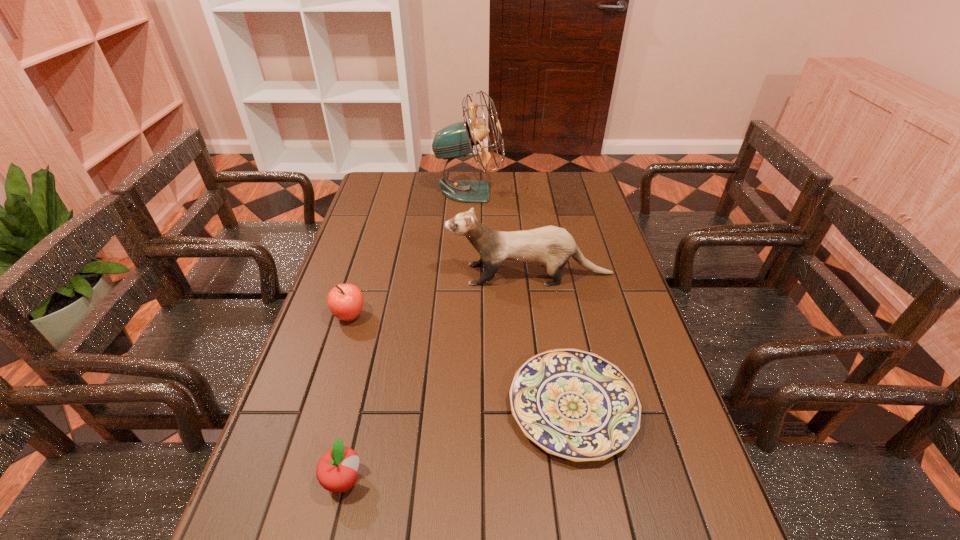
I want to click on fan, so click(456, 140).

Where is `the tallest object`? Image resolution: width=960 pixels, height=540 pixels. the tallest object is located at coordinates (456, 140).

Where is `the second farthest object`? the second farthest object is located at coordinates (551, 246).

Find the location of a particular element. This screenshot has height=540, width=960. the fourth shortest object is located at coordinates (551, 246).

Locate an element on the screen. the leftmost object is located at coordinates (345, 301).

You are a GUI agent. You are given a task and a screenshot of the screen. Output one action in this format:
    pyautogui.click(x=<x>, y=<y>)
    Task: Click on the left apple
    
    Given the screenshot: What is the action you would take?
    pyautogui.click(x=345, y=301)

Identify the location of the second object from left to right. (336, 471).

What are the coordinates of `the right apple` in the screenshot? It's located at (336, 471).

Locate an element on the screen. The image size is (960, 540). the shortest object is located at coordinates (573, 404).

You are a GUI agent. You are given a task and a screenshot of the screen. Output one action in this format:
    pyautogui.click(x=<x>, y=<y>)
    Task: Click on the vacant space located 0.300m on the front-facing side of the tallest object for air flow
    
    Given the screenshot: What is the action you would take?
    [581, 192]